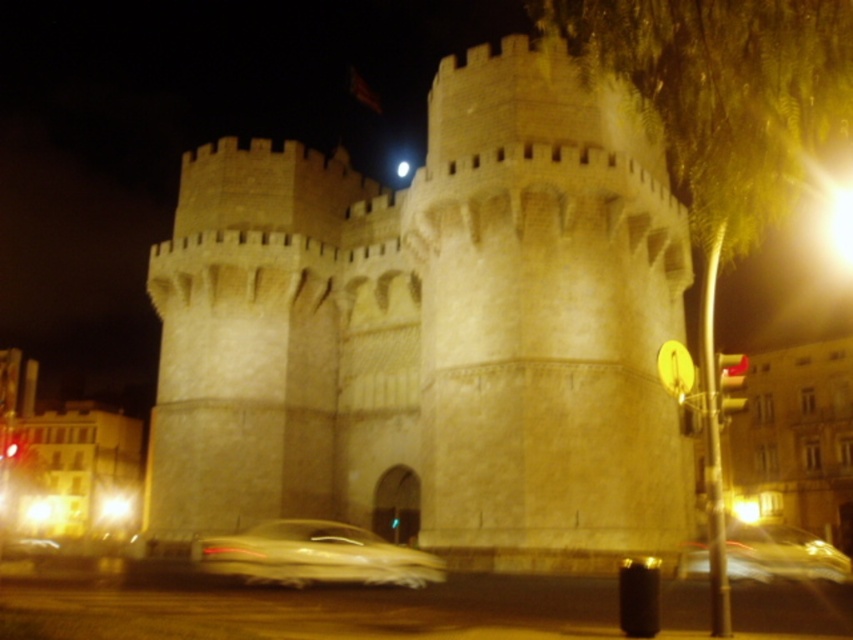
What do you see at coordinates (431, 333) in the screenshot? This screenshot has width=853, height=640. I see `stone castle at center` at bounding box center [431, 333].

Who is lower down, stone castle at center or metallic gold car at lower center?

metallic gold car at lower center

Which is in front, point (463, 433) or point (305, 557)?

Positioned in front is point (305, 557).

At what (x,y) coordinates should I click in order to perform the action: click on stone castle at center. Please return your answer as a coordinate pair (x, y). Image resolution: width=853 pixels, height=640 pixels. Looking at the image, I should click on (431, 333).